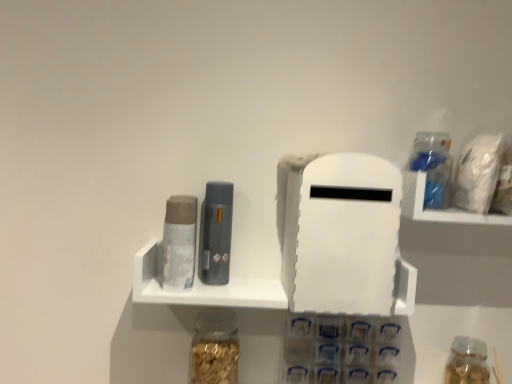
Question: From a real-world perspective, is translucent glass jar at lower center, the third bottle positioned from the right, on top of translucent plastic container at upper right?

Choices:
 (A) yes
 (B) no

Answer: (B)

Question: Is translucent plastic container at upper right at the back of translucent glass jar at lower center, the third bottle positioned from the right?

Choices:
 (A) yes
 (B) no

Answer: (B)

Question: Is translucent glass jar at lower center, positioned as the second bottle in top-to-bottom order, wider than translucent plastic container at upper right?

Choices:
 (A) no
 (B) yes

Answer: (A)

Question: Is translucent glass jar at lower center, which ranks as the second bottle in bottom-to-top order, smaller than translucent plastic container at upper right?

Choices:
 (A) no
 (B) yes

Answer: (B)

Question: Is translucent glass jar at lower center, positioned as the second bottle in top-to-bottom order, aimed at translucent plastic container at upper right?

Choices:
 (A) yes
 (B) no

Answer: (B)

Question: Do you think matte gray toiletry at center, positioned as the 1th toiletry in right-to-left order, is within translucent plastic container at upper right, or outside of it?

Choices:
 (A) outside
 (B) inside

Answer: (A)

Question: Looking at the image, does matte gray toiletry at center, positioned as the 1th toiletry in right-to-left order, seem bigger or smaller compared to translucent plastic container at upper right?

Choices:
 (A) small
 (B) big

Answer: (A)

Question: Considering the positions of matte gray toiletry at center, positioned as the 1th toiletry in right-to-left order, and translucent plastic container at upper right in the image, is matte gray toiletry at center, positioned as the 1th toiletry in right-to-left order, taller or shorter than translucent plastic container at upper right?

Choices:
 (A) short
 (B) tall

Answer: (B)

Question: Is matte gray toiletry at center, positioned as the 1th toiletry in right-to-left order, wider or thinner than translucent plastic container at upper right?

Choices:
 (A) wide
 (B) thin

Answer: (B)

Question: From a real-world perspective, relative to white matte plastic shelf at center, is translucent glass jar at lower center, the 1th bottle viewed from the left, vertically above or below?

Choices:
 (A) below
 (B) above

Answer: (A)

Question: Considering the positions of point (199, 332) and point (181, 296), is point (199, 332) closer or farther from the camera than point (181, 296)?

Choices:
 (A) farther
 (B) closer

Answer: (A)

Question: Choose the correct answer: Is translucent glass jar at lower center, the 1th bottle viewed from the left, inside white matte plastic shelf at center or outside it?

Choices:
 (A) outside
 (B) inside

Answer: (A)

Question: Looking at their shapes, would you say translucent glass jar at lower center, positioned as the second bottle in top-to-bottom order, is wider or thinner than white matte plastic shelf at center?

Choices:
 (A) wide
 (B) thin

Answer: (A)

Question: Is white matte plastic shelf at center in front of or behind translucent plastic container at upper right in the image?

Choices:
 (A) behind
 (B) front

Answer: (A)

Question: From their relative heights in the image, would you say white matte plastic shelf at center is taller or shorter than translucent plastic container at upper right?

Choices:
 (A) tall
 (B) short

Answer: (B)